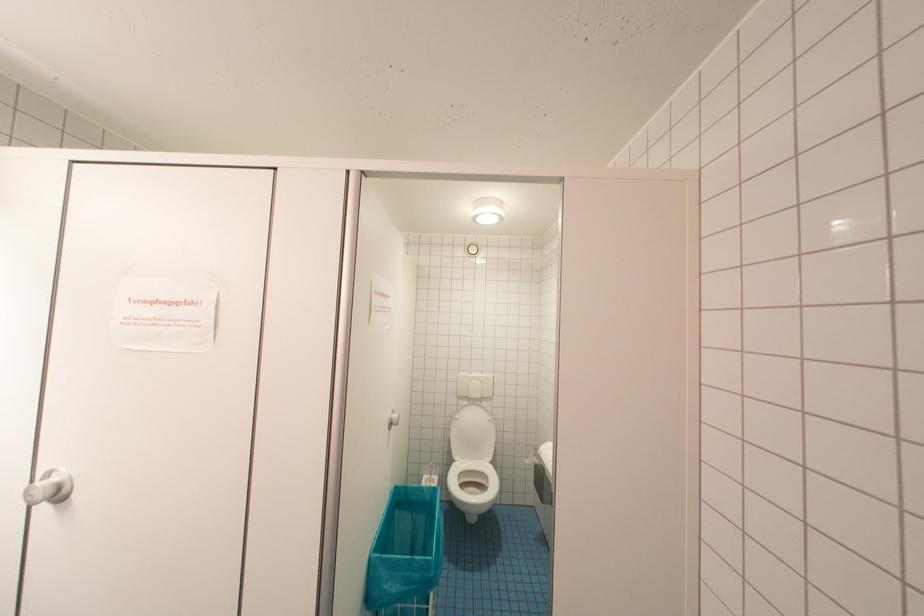
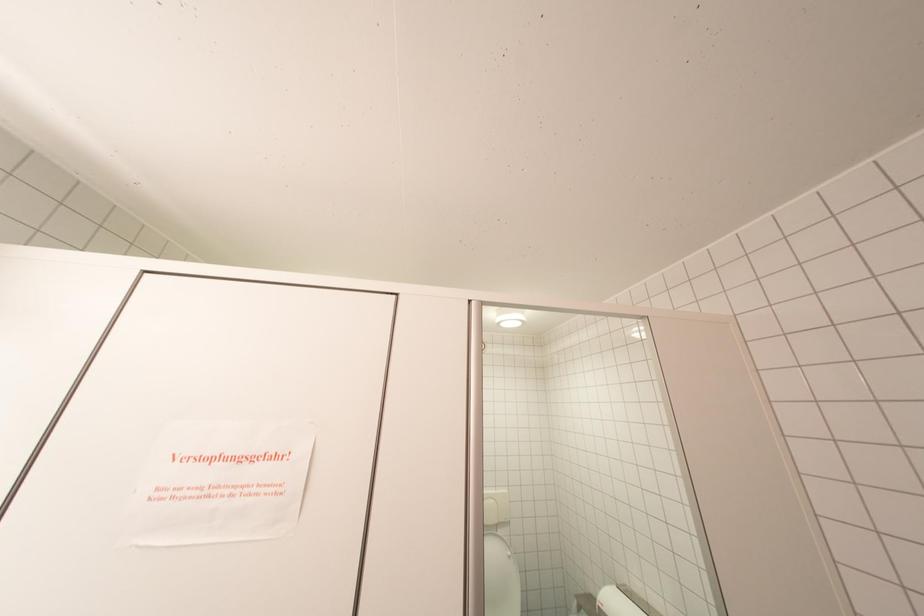
Question: How did the camera likely rotate?

Choices:
 (A) Left
 (B) Right
 (C) Up
 (D) Down

Answer: (C)